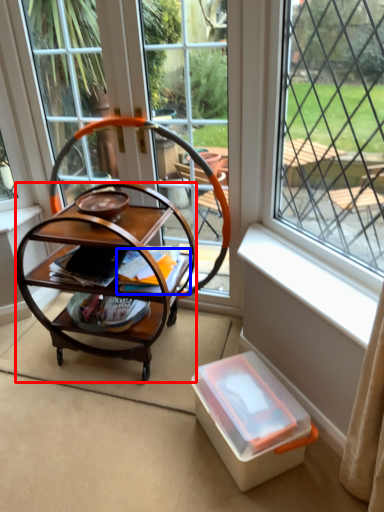
Question: Which point is closer to the camera, desk (highlighted by a red box) or magazine (highlighted by a blue box)?

Choices:
 (A) desk
 (B) magazine

Answer: (A)